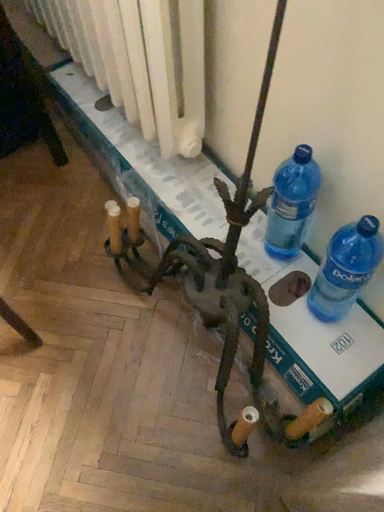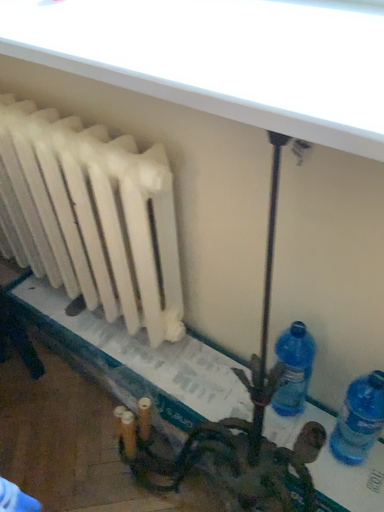
Question: Which way did the camera rotate in the video?

Choices:
 (A) rotated left
 (B) rotated right

Answer: (B)